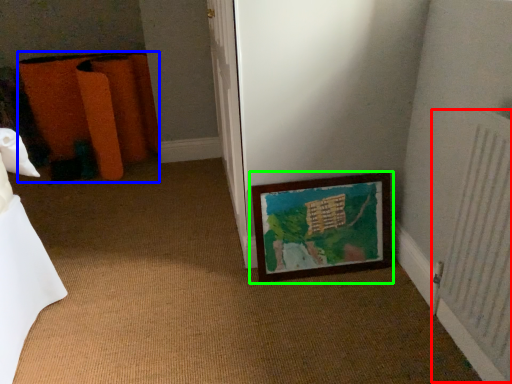
Question: Considering the real-world distances, which object is farthest from radiator (highlighted by a red box)? furniture (highlighted by a blue box) or picture frame (highlighted by a green box)?

Choices:
 (A) furniture
 (B) picture frame

Answer: (A)